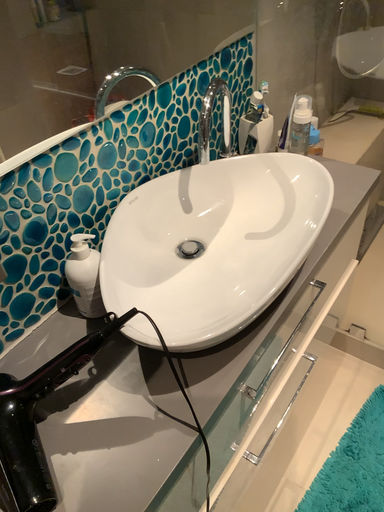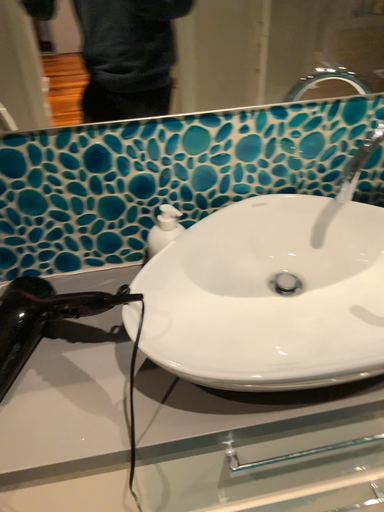
Question: Which way did the camera rotate in the video?

Choices:
 (A) rotated left
 (B) rotated right

Answer: (A)